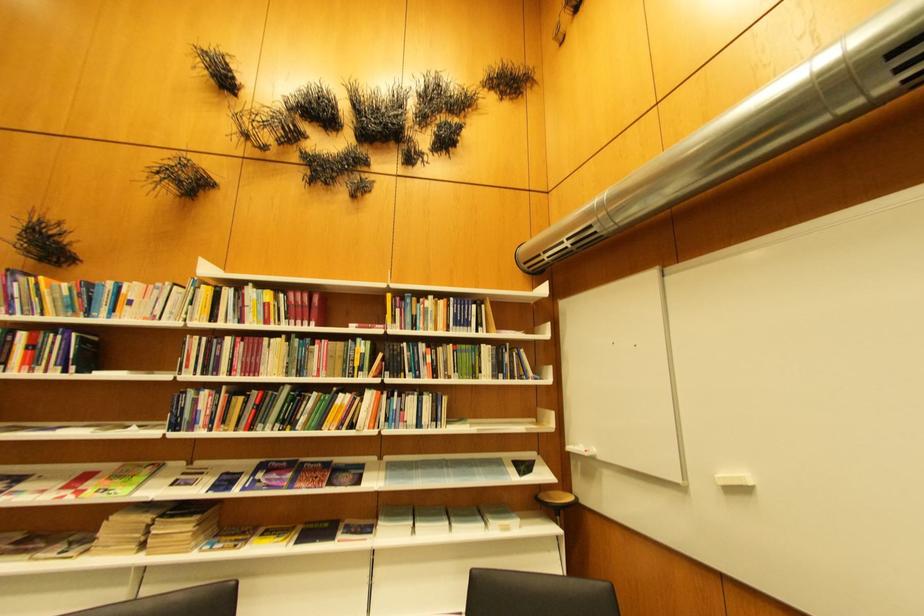
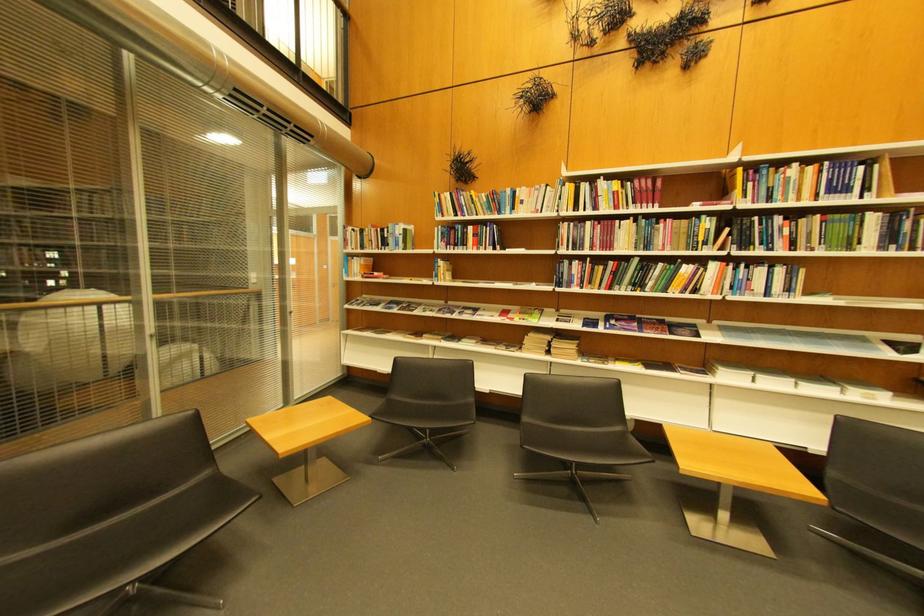
Find the pixel in the second image that matches (115,310) in the first image.

(518, 209)